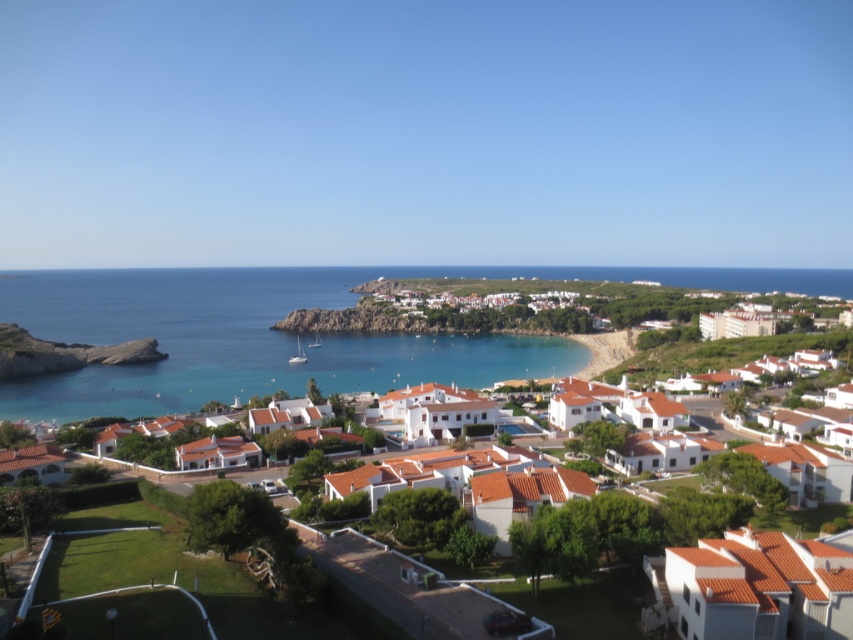
Consider the image. You are a tourist standing at the edge of the green lawn in the coastal town. You want to take a photo of the white matte houses at center and the blue water at center. Which one should you point your camera towards first if you want to capture both in a single shot?

You should point your camera towards the blue water at center first since the white matte houses at center is to the right of it, allowing both to be captured in the frame.

You are a tourist standing at the edge of the green lawn area in the coastal town. You want to take a photo of the white matte houses at center. Which direction should you face to capture them in your view?

The white matte houses at center are located at point (236,340), so you should face towards the center of the image to capture them in your view.